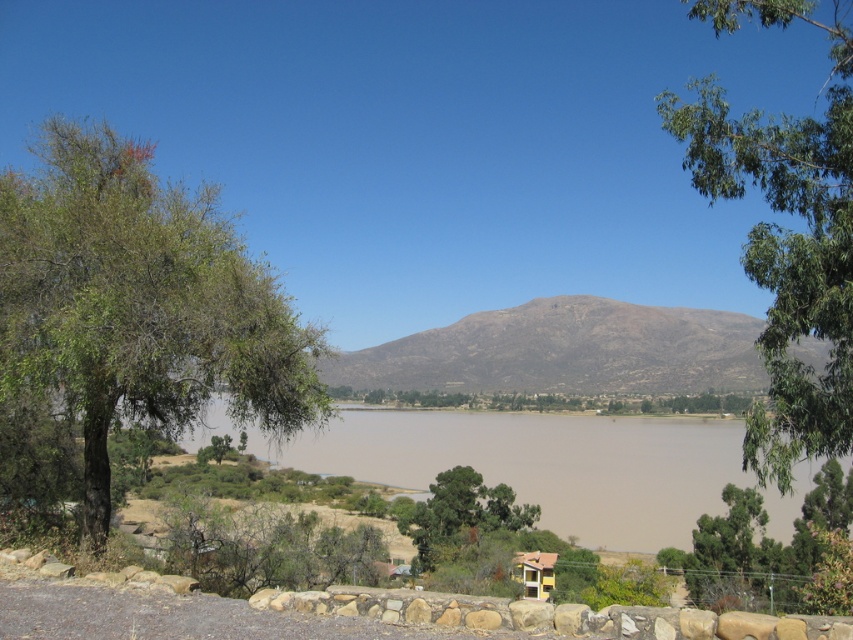
You are planning to set up a picnic area near the yellow matte gazebo at lower center. You want to ensure there is enough space between the picnic area and the green leafy tree at left for a 100 feet long tent. Is the distance sufficient?

The distance between the green leafy tree at left and the yellow matte gazebo at lower center is 140.26 feet, which is more than enough to accommodate a 100 feet long tent between them.